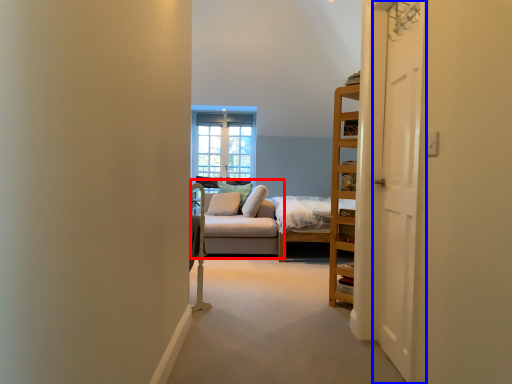
Question: Which object is further to the camera taking this photo, studio couch (highlighted by a red box) or door (highlighted by a blue box)?

Choices:
 (A) studio couch
 (B) door

Answer: (A)